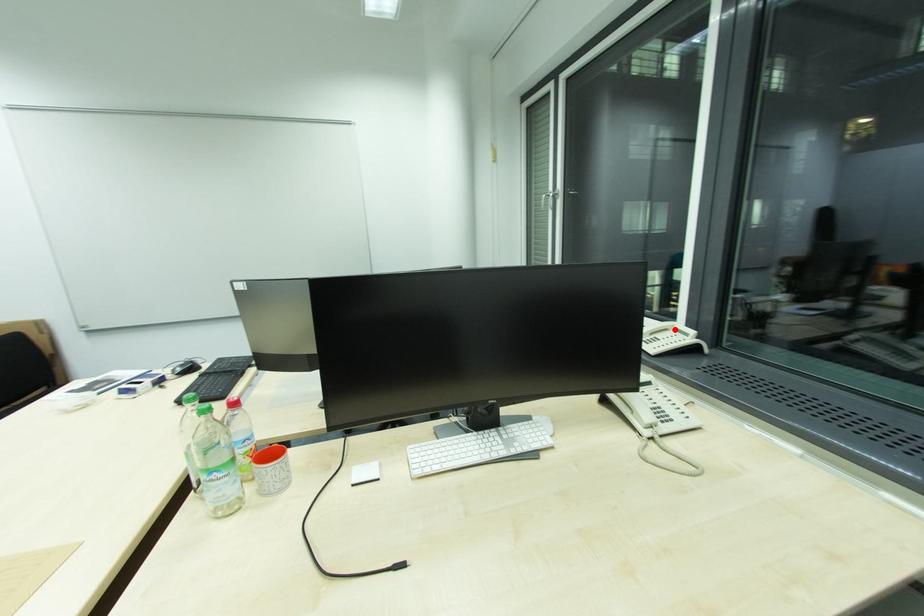
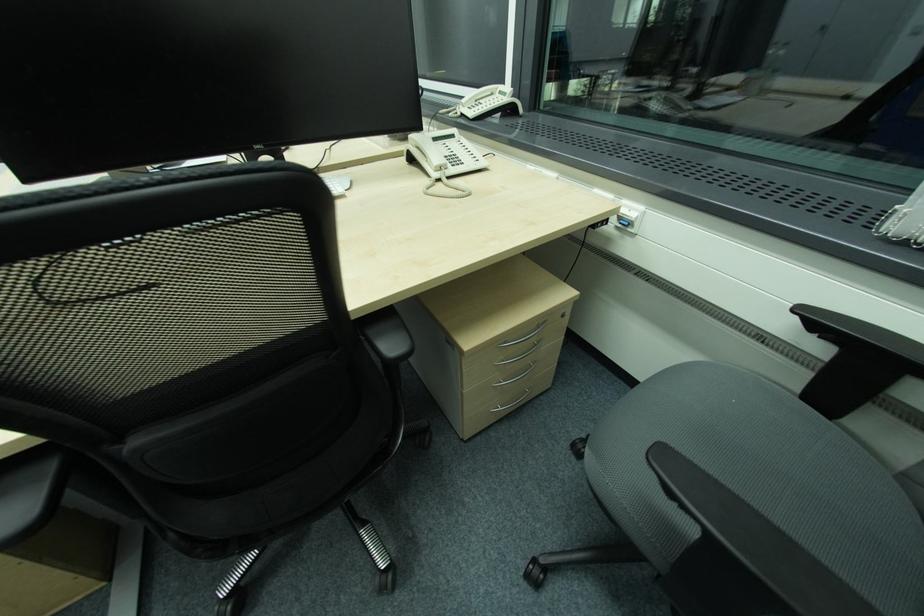
The point at the highlighted location is marked in the first image. Where is the corresponding point in the second image?

(501, 92)